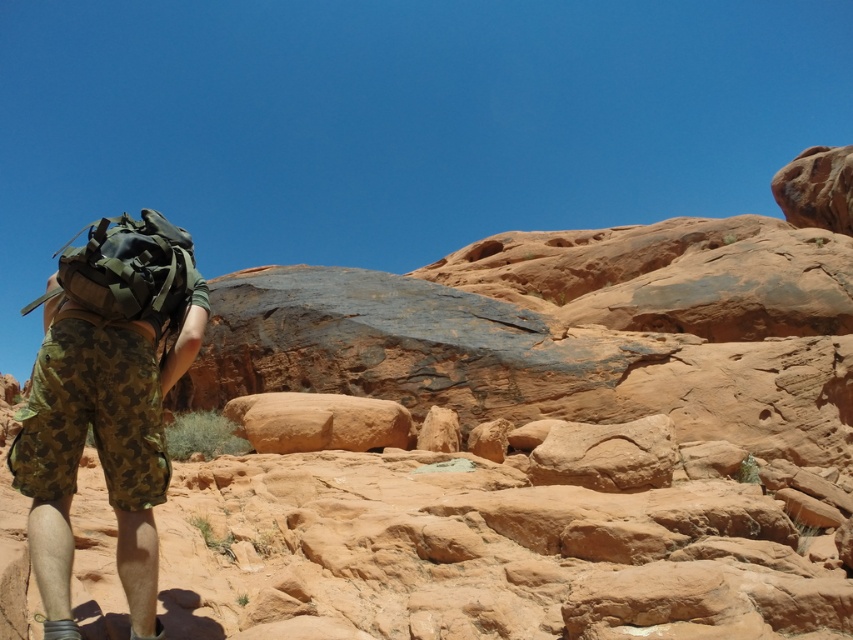
You are a photographer trying to capture the hiker in this desert scene. You want to frame your shot so that both the camo fabric shorts at lower left and the matte green backpack at left are visible. Based on their positions, which object should be placed closer to the left edge of your camera frame?

The camo fabric shorts at lower left should be placed closer to the left edge of your camera frame because it is positioned to the left of the matte green backpack at left.

You are standing at the point labeled point (67, 365) in the desert scene. If you walk directly toward the hiker, how far will you have to travel before reaching them?

The point labeled point (67, 365) is 119.26 feet away from the viewer. Since the hiker is in the same scene, walking directly toward the hiker from the point would require traveling 119.26 feet to reach them.

You are a photographer trying to capture the hiker in the image. You want to ensure both the camo fabric shorts at lower left and the matte green backpack at left are clearly visible in your shot. Which object should you focus on first to ensure it doesn

The camo fabric shorts at lower left is not as tall as the matte green backpack at left, so you should focus on the matte green backpack at left first since it is taller and more prominent in the frame.